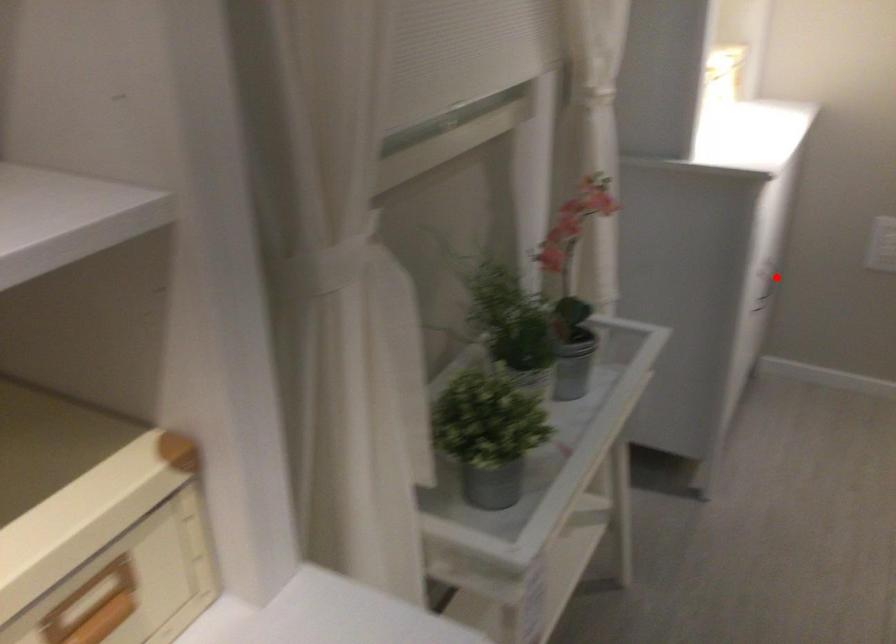
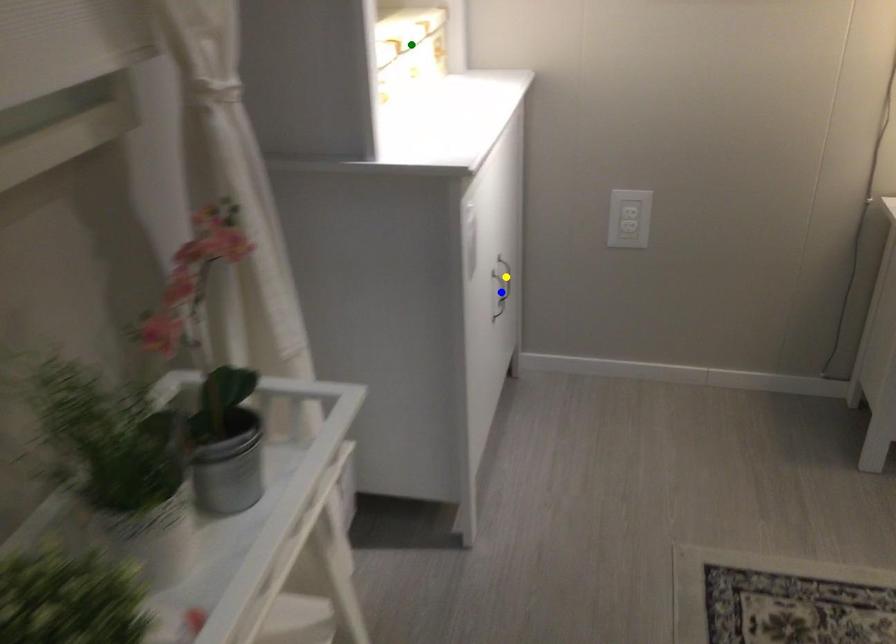
Question: I am providing you with two images of the same scene from different viewpoints. A red point is marked on the first image. You are given multiple points on the second image. Which point in image 2 represents the same 3d spot as the red point in image 1?

Choices:
 (A) yellow point
 (B) blue point
 (C) green point

Answer: (A)